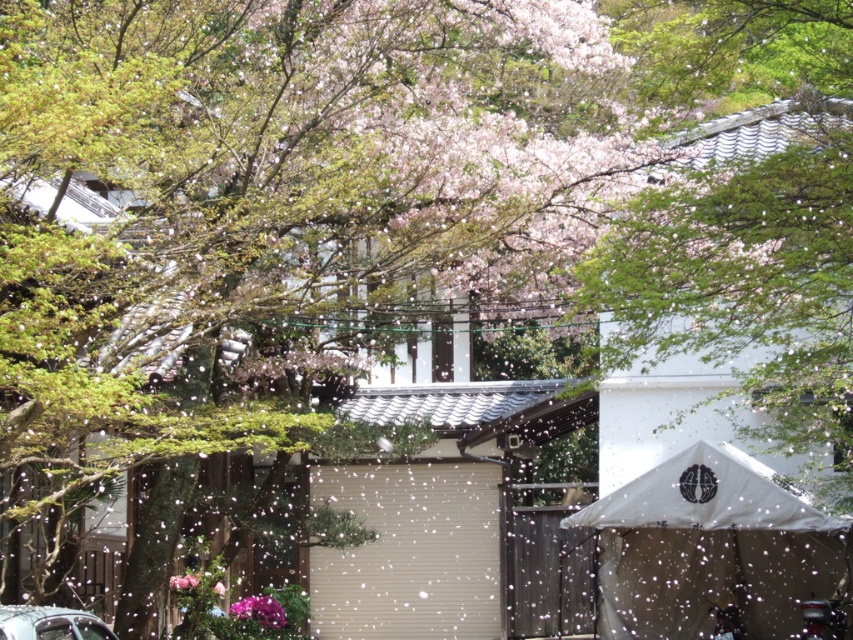
Which is more to the left, white fabric canopy at center or pink matte flower at lower center?

pink matte flower at lower center is more to the left.

What do you see at coordinates (706, 497) in the screenshot? This screenshot has width=853, height=640. I see `white fabric canopy at center` at bounding box center [706, 497].

The width and height of the screenshot is (853, 640). Find the location of `white fabric canopy at center`. white fabric canopy at center is located at coordinates (706, 497).

Between white fabric canopy at center and metallic silver car at lower left, which one has less height?

Standing shorter between the two is metallic silver car at lower left.

Between white fabric canopy at center and metallic silver car at lower left, which one appears on the right side from the viewer's perspective?

white fabric canopy at center is more to the right.

I want to click on white fabric canopy at center, so click(706, 497).

Identify the location of white fabric canopy at center. (706, 497).

Is white canvas canopy at center shorter than white fabric canopy at center?

Incorrect, white canvas canopy at center's height does not fall short of white fabric canopy at center's.

Who is more distant from viewer, (788, 616) or (764, 493)?

The point (788, 616) is behind.

You are a GUI agent. You are given a task and a screenshot of the screen. Output one action in this format:
    pyautogui.click(x=<x>, y=<y>)
    Task: Click on the white canvas canopy at center
    This screenshot has height=640, width=853.
    Given the screenshot: What is the action you would take?
    pyautogui.click(x=711, y=548)